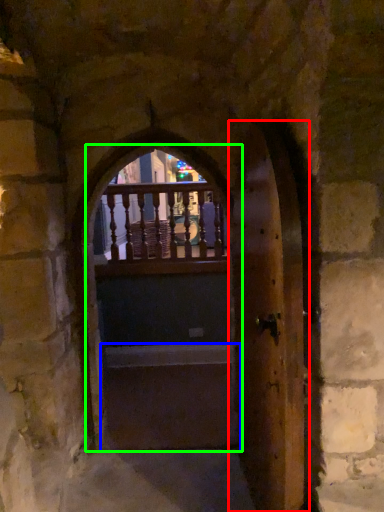
Question: Which object is the closest to the door (highlighted by a red box)? Choose among these: stairwell (highlighted by a blue box) or door (highlighted by a green box).

Choices:
 (A) stairwell
 (B) door

Answer: (A)